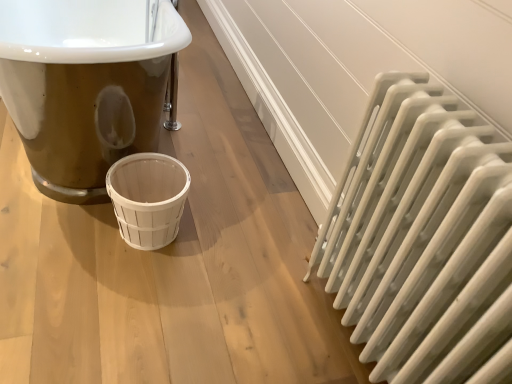
This screenshot has width=512, height=384. What are the coordinates of `vacant space to the right of white wood basket at center` in the screenshot? It's located at (227, 242).